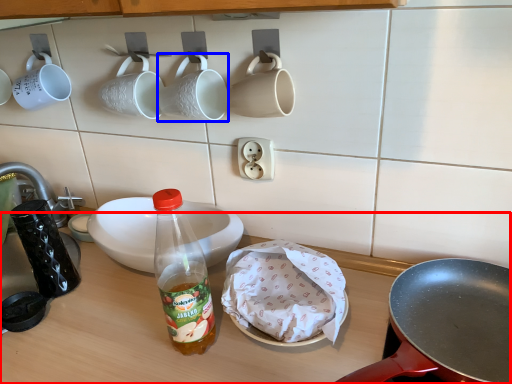
Question: Which object is closer to the camera taking this photo, table top (highlighted by a red box) or coffee cup (highlighted by a blue box)?

Choices:
 (A) table top
 (B) coffee cup

Answer: (A)